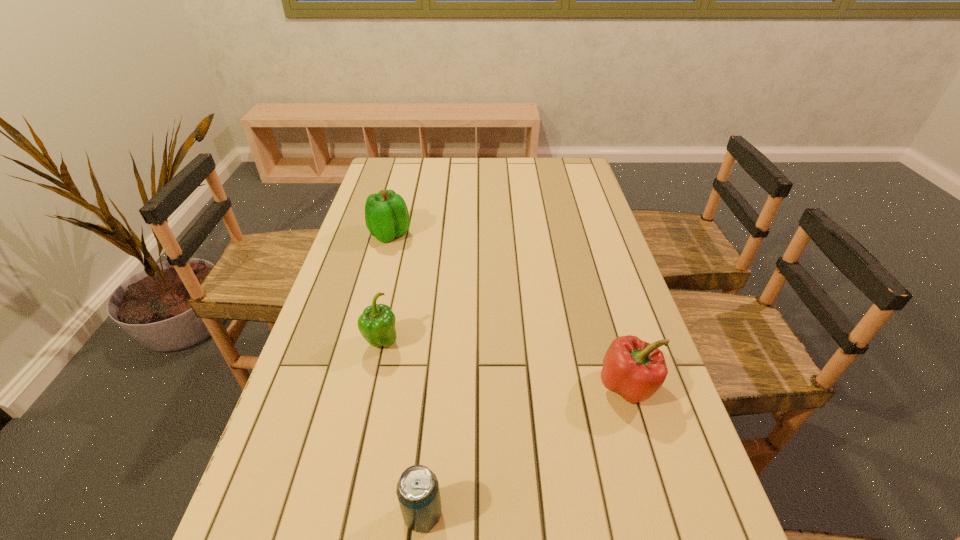
This screenshot has height=540, width=960. I want to click on free space between the nearest object and the second farthest bell pepper, so pyautogui.click(x=402, y=428).

Image resolution: width=960 pixels, height=540 pixels. In order to click on free spot between the farthest object and the second nearest object in this screenshot , I will do `click(509, 310)`.

At what (x,y) coordinates should I click in order to perform the action: click on free space between the farthest object and the second farthest object. Please return your answer as a coordinate pair (x, y). Looking at the image, I should click on (386, 288).

Locate an element on the screen. Image resolution: width=960 pixels, height=540 pixels. unoccupied area between the farthest object and the third nearest object is located at coordinates tap(386, 288).

At what (x,y) coordinates should I click in order to perform the action: click on free point between the farthest object and the nearest object. Please return your answer as a coordinate pair (x, y). The height and width of the screenshot is (540, 960). Looking at the image, I should click on (406, 374).

Identify the location of the second closest object to the farthest object. The height and width of the screenshot is (540, 960). pyautogui.click(x=634, y=369).

Find the location of a particular element. Image resolution: width=960 pixels, height=540 pixels. object that is the closest one to the rightmost object is located at coordinates (418, 493).

Point out which bell pepper is positioned as the nearest to the farthest bell pepper. Please provide its 2D coordinates. Your answer should be formatted as a tuple, i.e. [(x, y)], where the tuple contains the x and y coordinates of a point satisfying the conditions above.

[(376, 324)]

Where is `bell pepper that is the closest to the rightmost bell pepper`? Image resolution: width=960 pixels, height=540 pixels. bell pepper that is the closest to the rightmost bell pepper is located at coordinates (376, 324).

Where is `blank space that satisfies the following two spatial constraints: 1. on the front side of the third farthest object; 2. on the right side of the farthest bell pepper`? The image size is (960, 540). blank space that satisfies the following two spatial constraints: 1. on the front side of the third farthest object; 2. on the right side of the farthest bell pepper is located at coordinates (350, 386).